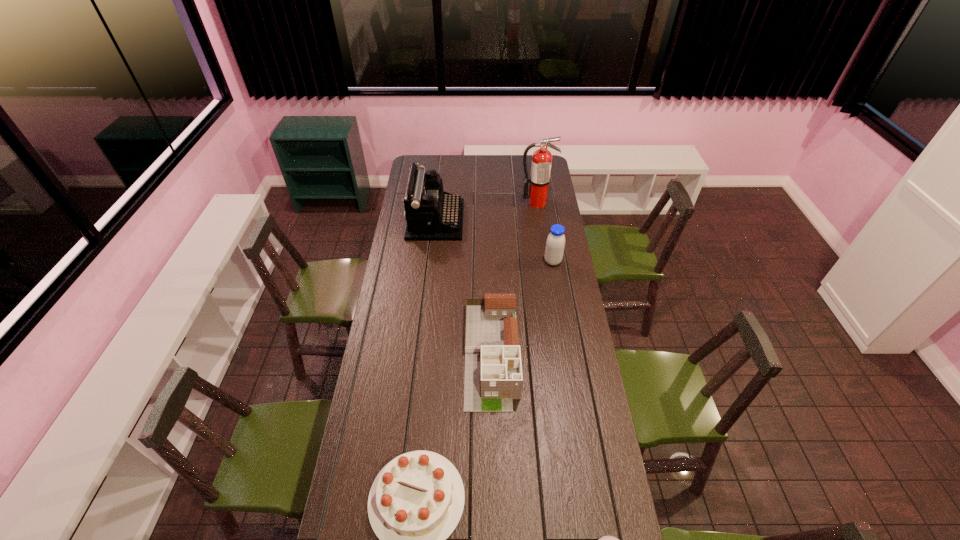
The image size is (960, 540). What are the coordinates of `object at the left edge` in the screenshot? It's located at (432, 214).

Find the location of `fire extinguisher that is at the right edge`. fire extinguisher that is at the right edge is located at coordinates (539, 179).

This screenshot has height=540, width=960. Identify the location of soya milk that is at the right edge. (555, 243).

This screenshot has height=540, width=960. In order to click on vacant space at the far edge of the desktop in this screenshot , I will do [x=437, y=161].

The width and height of the screenshot is (960, 540). In the image, there is a desktop. Identify the location of vacant space at the left edge. (387, 380).

Locate an element on the screen. vacant point at the right edge is located at coordinates (548, 205).

Locate an element on the screen. Image resolution: width=960 pixels, height=540 pixels. free location at the far left corner is located at coordinates (435, 168).

At what (x,y) coordinates should I click in order to perform the action: click on vacant area that lies between the fire extinguisher and the dollhouse. Please return your answer as a coordinate pair (x, y). The width and height of the screenshot is (960, 540). Looking at the image, I should click on (514, 278).

Where is `vacant region between the typewriter and the fire extinguisher`? vacant region between the typewriter and the fire extinguisher is located at coordinates (x=486, y=211).

Where is `unoccupied area between the tallest object and the third nearest object`? This screenshot has width=960, height=540. unoccupied area between the tallest object and the third nearest object is located at coordinates (514, 278).